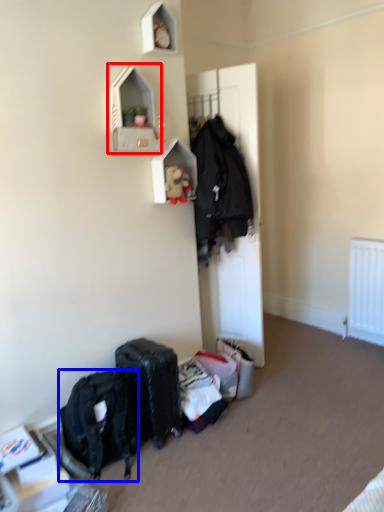
Question: Among these objects, which one is farthest to the camera, shelf (highlighted by a red box) or backpack (highlighted by a blue box)?

Choices:
 (A) shelf
 (B) backpack

Answer: (A)